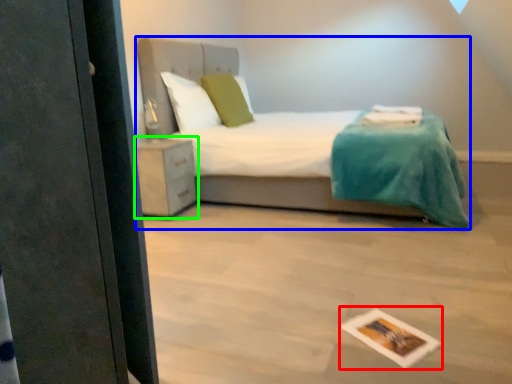
Question: Which is farther away from postcard (highlighted by a red box)? bed (highlighted by a blue box) or nightstand (highlighted by a green box)?

Choices:
 (A) bed
 (B) nightstand

Answer: (B)